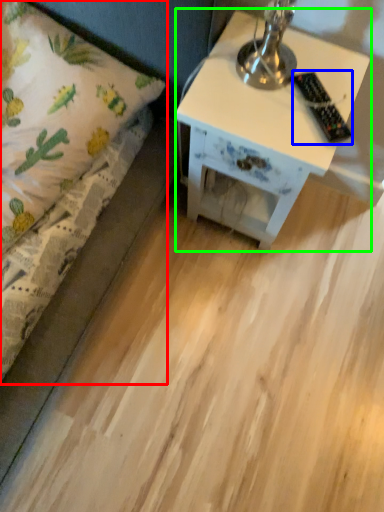
Question: Based on their relative distances, which object is nearer to bed (highlighted by a red box)? Choose from remote control (highlighted by a blue box) and nightstand (highlighted by a green box).

Choices:
 (A) remote control
 (B) nightstand

Answer: (B)